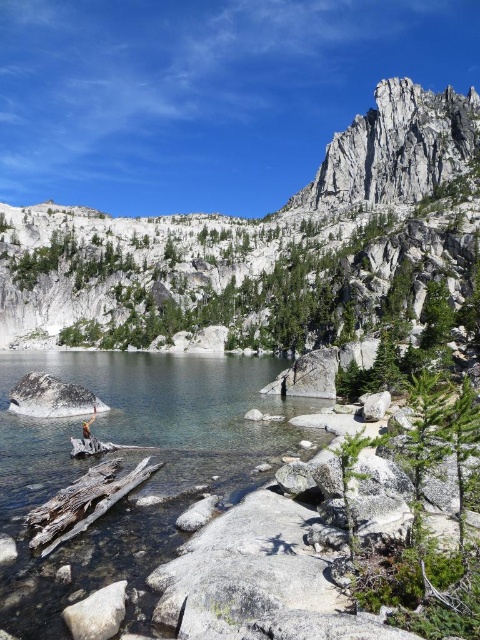
Question: Which object is farther from the camera taking this photo?

Choices:
 (A) brown leather jacket at center
 (B) gray/rough rock mountain at upper center
 (C) gray granite rock at lower right
 (D) gray granite rock at center

Answer: (B)

Question: Can you confirm if gray/rough rock mountain at upper center is positioned to the right of brown leather jacket at center?

Choices:
 (A) no
 (B) yes

Answer: (B)

Question: Is gray granite rock at lower right positioned before brown leather jacket at center?

Choices:
 (A) no
 (B) yes

Answer: (A)

Question: Is gray granite rock at center to the right of gray granite rock at lower right from the viewer's perspective?

Choices:
 (A) yes
 (B) no

Answer: (B)

Question: Which point is closer to the camera?

Choices:
 (A) (84, 429)
 (B) (33, 412)

Answer: (A)

Question: Which of the following is the closest to the observer?

Choices:
 (A) (17, 412)
 (B) (0, 323)
 (C) (372, 404)
 (D) (94, 419)

Answer: (C)